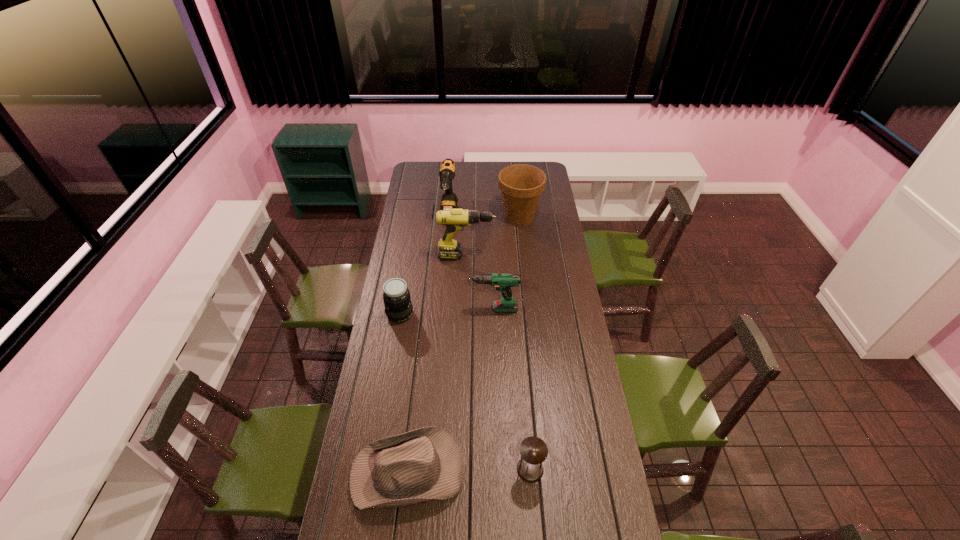
Identify the location of drill that can be found as the second closest to the fifth nearest object. (503, 282).

Find the location of a particular element. free spot that satisfies the following two spatial constraints: 1. on the handle side of the shortest drill; 2. on the right side of the hourglass is located at coordinates (493, 469).

Locate an element on the screen. This screenshot has width=960, height=540. free spot that satisfies the following two spatial constraints: 1. on the back side of the fedora; 2. on the right side of the hourglass is located at coordinates (408, 469).

I want to click on vacant area in the image that satisfies the following two spatial constraints: 1. on the handle side of the fifth nearest object; 2. on the right side of the hourglass, so click(x=459, y=469).

This screenshot has width=960, height=540. In order to click on free space that satisfies the following two spatial constraints: 1. on the handle side of the hourglass; 2. on the right side of the fourth shortest object in this screenshot , I will do `click(493, 469)`.